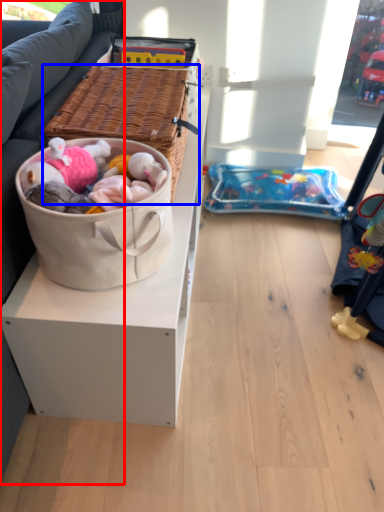
Question: Which of the following is the farthest to the observer, studio couch (highlighted by a red box) or picnic basket (highlighted by a blue box)?

Choices:
 (A) studio couch
 (B) picnic basket

Answer: (B)